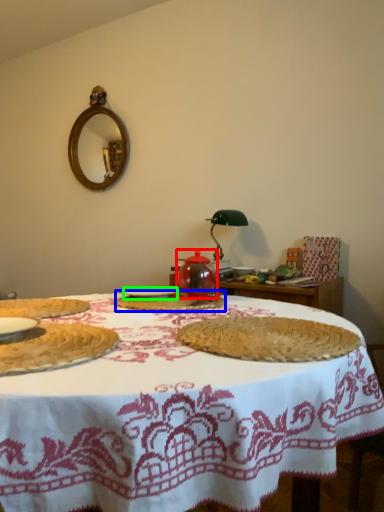
Question: Which object is positioned farthest from tea pot (highlighted by a red box)? Select from food (highlighted by a blue box) and tableware (highlighted by a green box).

Choices:
 (A) food
 (B) tableware

Answer: (B)